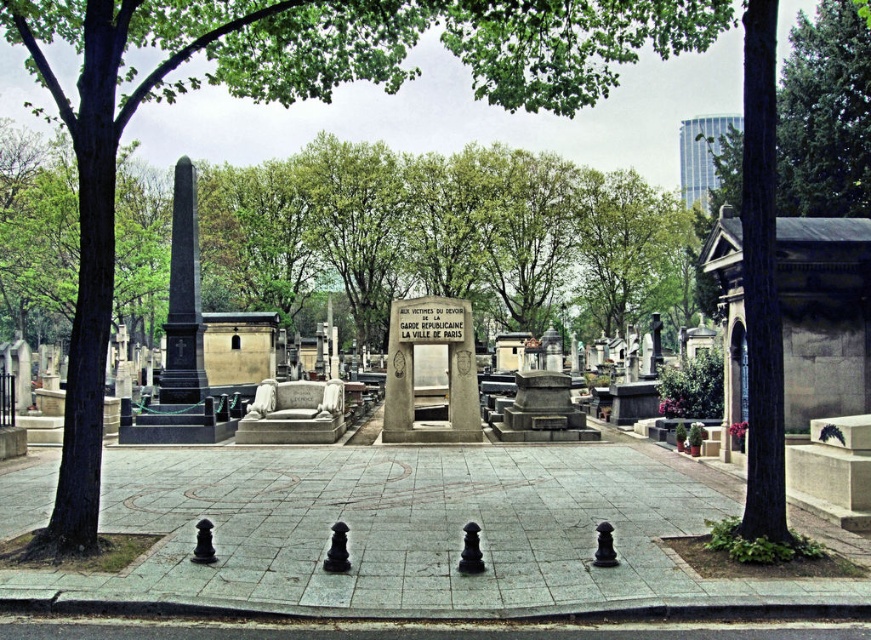
Does green leafy tree at center come in front of polished stone monument at center?

Yes.

Does green leafy tree at center have a greater width compared to polished stone monument at center?

Yes, green leafy tree at center is wider than polished stone monument at center.

Between point (358, 49) and point (404, 403), which one is positioned behind?

Positioned behind is point (404, 403).

Where is `green leafy tree at center`? The width and height of the screenshot is (871, 640). green leafy tree at center is located at coordinates (289, 104).

Can you confirm if green leafy tree at upper center is taller than polished granite obelisk at left?

Yes, green leafy tree at upper center is taller than polished granite obelisk at left.

Can you confirm if green leafy tree at upper center is positioned above polished granite obelisk at left?

Yes.

Who is more distant from viewer, (820, 116) or (179, 237)?

Point (820, 116)

The width and height of the screenshot is (871, 640). Find the location of `green leafy tree at upper center`. green leafy tree at upper center is located at coordinates (824, 115).

The image size is (871, 640). What do you see at coordinates (289, 104) in the screenshot?
I see `green leafy tree at center` at bounding box center [289, 104].

In the scene shown: Between green leafy tree at center and green leafy tree at upper center, which one is positioned higher?

green leafy tree at center is above.

Which is behind, point (80, 461) or point (734, 131)?

The point (734, 131) is more distant.

Find the location of `green leafy tree at center`. green leafy tree at center is located at coordinates (289, 104).